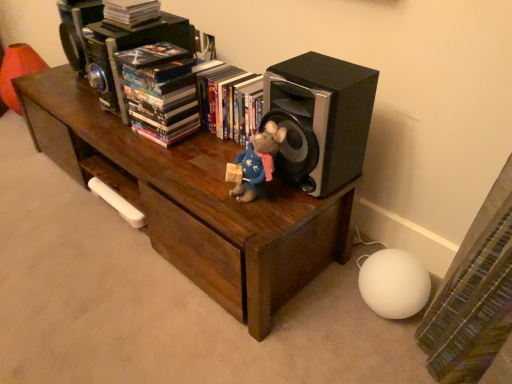
The width and height of the screenshot is (512, 384). In order to click on vacant area situated to the left side of velvety blue plush at center in this screenshot , I will do `click(204, 184)`.